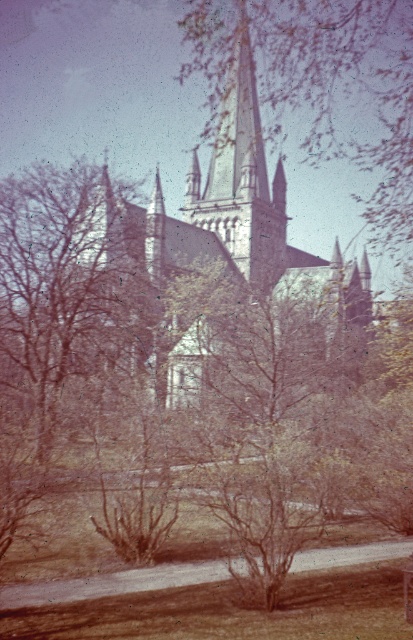
Consider the image. You are standing in front of the historic church and want to take a photo that includes both the central spire and the garden area. If you focus your camera on point A at point (14,221) and point B at point (270,236), which point will appear closer to the camera in the photo?

Point A at point (14,221) will appear closer to the camera in the photo because it is physically closer to the camera than point B at point (270,236).